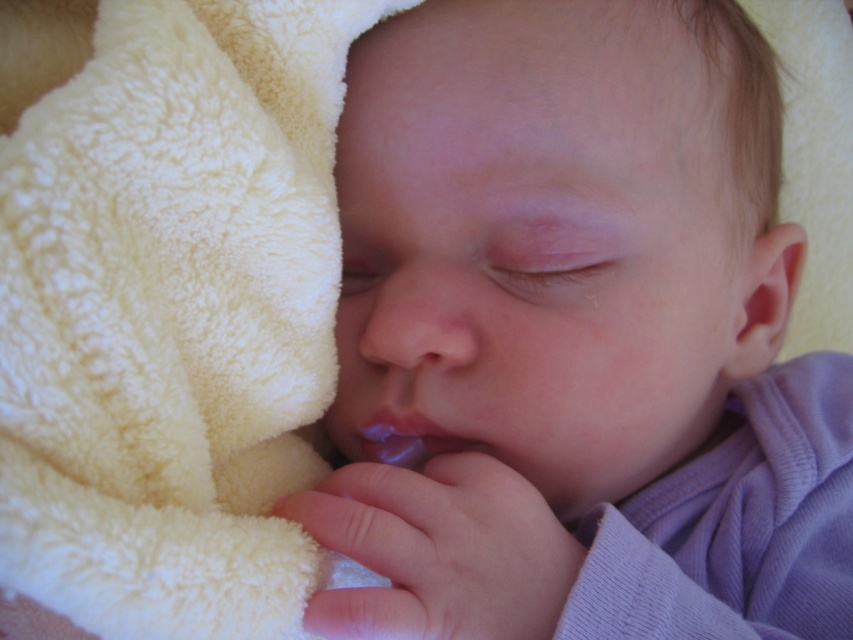
You are a photographer aiming to capture a close detail shot of the smooth purple cloth at center. The camera lens needs to be at least 13 inches away to avoid distortion. Based on the scene, can you position the camera lens properly?

The smooth purple cloth at center is 12.94 inches from viewer, which is slightly less than the required 13 inches. Therefore, the camera lens is too close and may cause distortion.

Based on the scene description, which object is taller between the smooth purple cloth at center and the creamy soft blanket at left?

The smooth purple cloth at center is much taller than the creamy soft blanket at left.

What is the texture of the material located at point [587,337] in the image?

The point [587,337] indicates smooth purple cloth at center, so the texture is smooth.